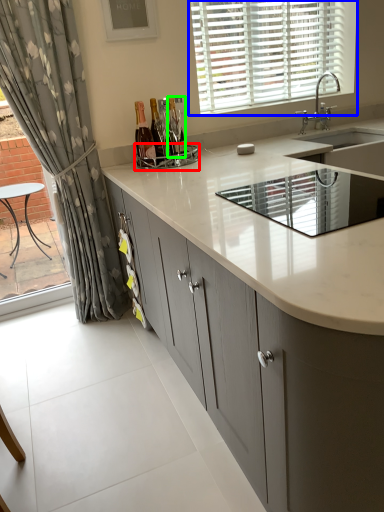
Question: Which object is the farthest from appliance (highlighted by a red box)? Choose among these: window (highlighted by a blue box) or bottle (highlighted by a green box).

Choices:
 (A) window
 (B) bottle

Answer: (A)